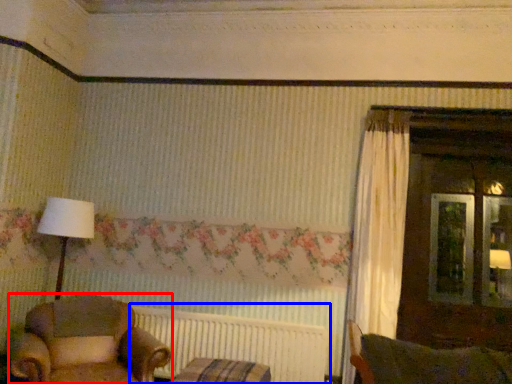
Question: Which object is further to the camera taking this photo, chair (highlighted by a red box) or radiator (highlighted by a blue box)?

Choices:
 (A) chair
 (B) radiator

Answer: (B)